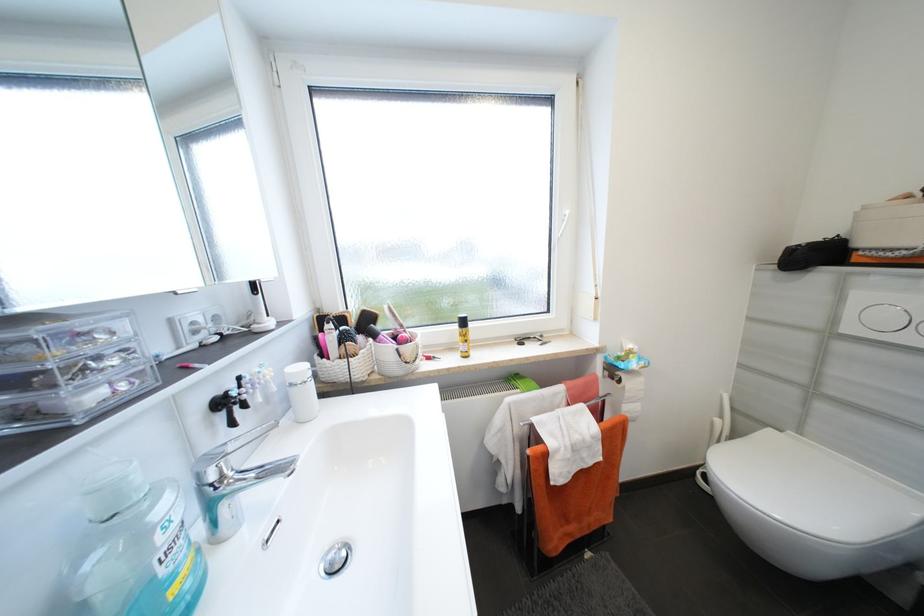
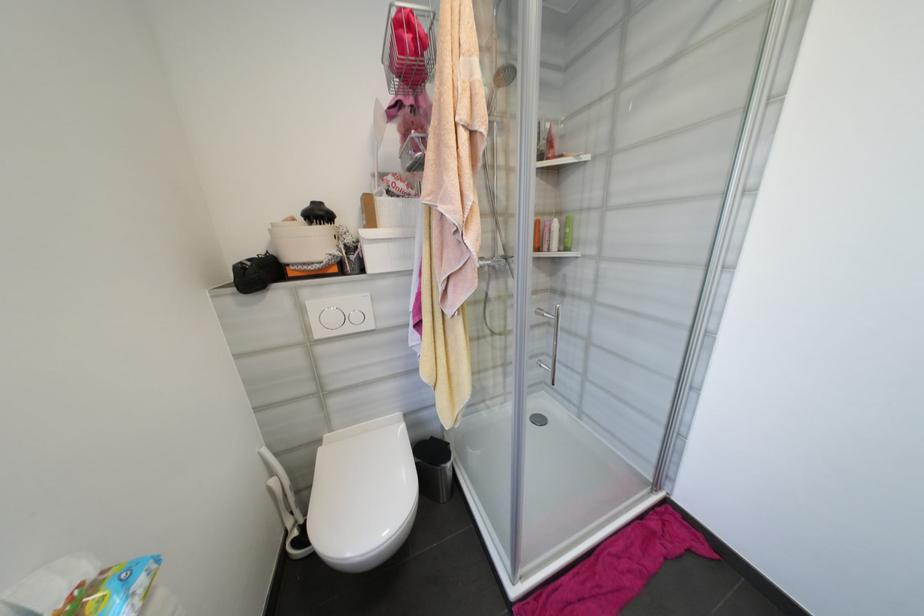
Where in the second image is the point corresponding to [870,208] from the first image?

(280, 225)